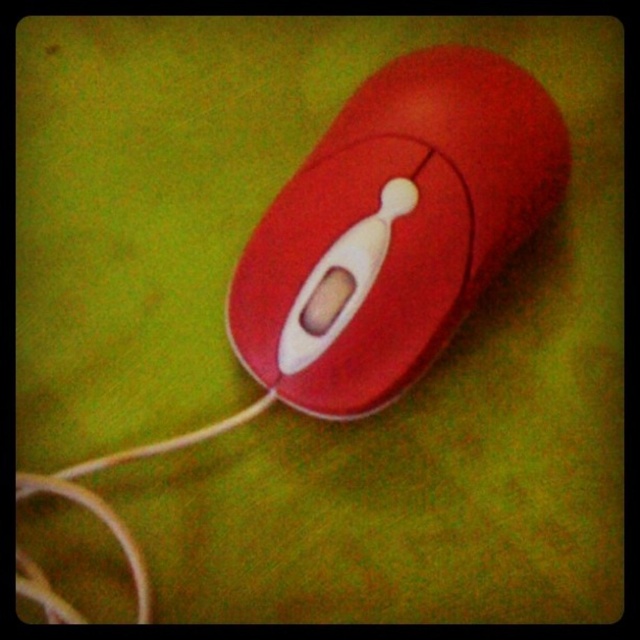
You are setting up a new computer workstation and need to organize cables. You have a matte plastic mouse at center and a white matte string at lower left. Which object should you adjust first to ensure proper cable management, and why?

You should adjust the white matte string at lower left first because the matte plastic mouse at center is located above it, so moving the string from below would prevent disturbing the mouse.

You are setting up a desk and need to place the matte plastic mouse at center and the white matte string at lower left. The desk has limited space, and you want to know if the distance between them is sufficient for comfortable use. Given that the minimum recommended distance between such items is 12 inches, can you confirm if the current placement meets this requirement?

The matte plastic mouse at center is 14.70 inches from the white matte string at lower left, which exceeds the minimum recommended distance of 12 inches. Therefore, the current placement meets the requirement.

You are organizing a desk and need to place the matte plastic mouse at center and the white matte string at lower left. According to the image, which object is positioned to the right side?

The matte plastic mouse at center is positioned to the right of the white matte string at lower left.